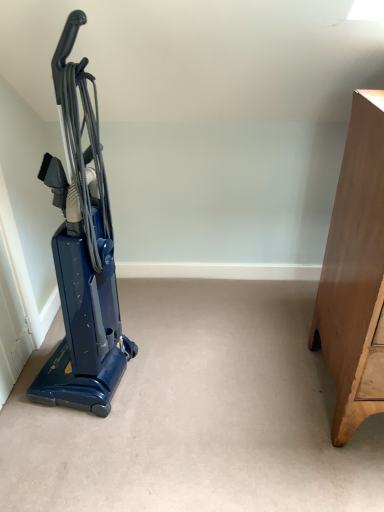
Where is `vacant location behind blue glossy vacuum cleaner at left`? The height and width of the screenshot is (512, 384). vacant location behind blue glossy vacuum cleaner at left is located at coordinates (139, 324).